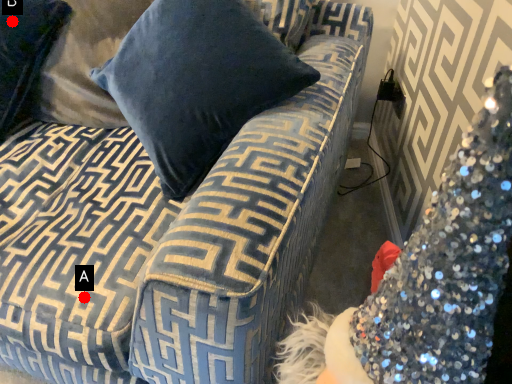
Question: Two points are circled on the image, labeled by A and B beside each circle. Which of the following is the closest to the observer?

Choices:
 (A) A is closer
 (B) B is closer

Answer: (A)